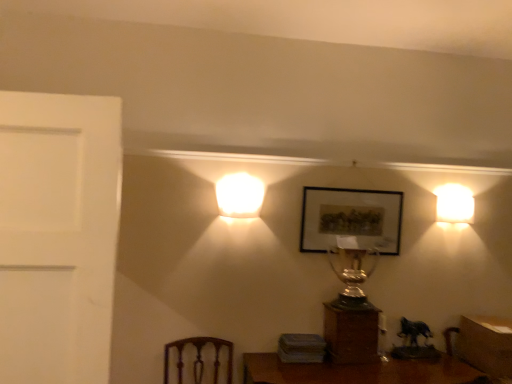
Question: Is white glossy wall sconce at right, which ranks as the second lamp in front-to-back order, at the right side of matte black picture frame at center?

Choices:
 (A) yes
 (B) no

Answer: (A)

Question: Is white glossy wall sconce at right, which appears as the 2th lamp when viewed from the left, positioned with its back to matte black picture frame at center?

Choices:
 (A) yes
 (B) no

Answer: (B)

Question: From a real-world perspective, is white glossy wall sconce at right, the 1th lamp in the back-to-front sequence, located beneath matte black picture frame at center?

Choices:
 (A) yes
 (B) no

Answer: (B)

Question: Considering the relative sizes of white glossy wall sconce at right, the 1th lamp in the back-to-front sequence, and matte black picture frame at center in the image provided, is white glossy wall sconce at right, the 1th lamp in the back-to-front sequence, wider than matte black picture frame at center?

Choices:
 (A) no
 (B) yes

Answer: (B)

Question: From the image's perspective, is white glossy wall sconce at right, which appears as the 2th lamp when viewed from the left, below matte black picture frame at center?

Choices:
 (A) yes
 (B) no

Answer: (B)

Question: Is wooden table at lower right wider or thinner than matte black picture frame at center?

Choices:
 (A) wide
 (B) thin

Answer: (A)

Question: Considering their positions, is wooden table at lower right located in front of or behind matte black picture frame at center?

Choices:
 (A) behind
 (B) front

Answer: (B)

Question: Based on their positions, is wooden table at lower right located to the left or right of matte black picture frame at center?

Choices:
 (A) left
 (B) right

Answer: (B)

Question: Is wooden table at lower right taller or shorter than matte black picture frame at center?

Choices:
 (A) tall
 (B) short

Answer: (B)

Question: Looking at their shapes, would you say wooden table at lower right is wider or thinner than wooden trophy at center?

Choices:
 (A) thin
 (B) wide

Answer: (B)

Question: From the image's perspective, is wooden table at lower right above or below wooden trophy at center?

Choices:
 (A) below
 (B) above

Answer: (A)

Question: Is point (507, 355) closer or farther from the camera than point (328, 309)?

Choices:
 (A) farther
 (B) closer

Answer: (B)

Question: In terms of height, does wooden table at lower right look taller or shorter compared to wooden trophy at center?

Choices:
 (A) tall
 (B) short

Answer: (A)

Question: Considering the positions of matte black picture frame at center and wooden table at lower right in the image, is matte black picture frame at center wider or thinner than wooden table at lower right?

Choices:
 (A) thin
 (B) wide

Answer: (A)

Question: In the image, is matte black picture frame at center on the left side or the right side of wooden table at lower right?

Choices:
 (A) left
 (B) right

Answer: (A)